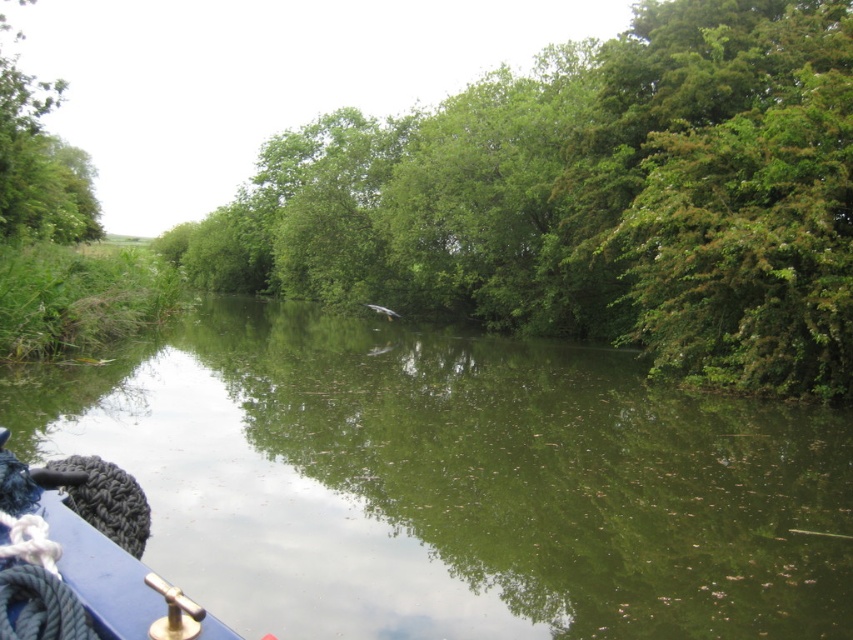
Question: In this image, where is blue matte rope at lower left located relative to green leafy tree at upper left?

Choices:
 (A) below
 (B) above

Answer: (A)

Question: Is green reflective water at center smaller than green leafy tree at upper left?

Choices:
 (A) no
 (B) yes

Answer: (B)

Question: Does green leafy tree at center appear on the right side of green leafy tree at upper left?

Choices:
 (A) no
 (B) yes

Answer: (B)

Question: Which point is farther to the camera?

Choices:
 (A) green reflective water at center
 (B) blue matte rope at lower left

Answer: (A)

Question: Which point appears closest to the camera in this image?

Choices:
 (A) (148, 602)
 (B) (294, 472)

Answer: (A)

Question: Which of the following is the farthest from the observer?

Choices:
 (A) green leafy tree at center
 (B) green reflective water at center

Answer: (A)